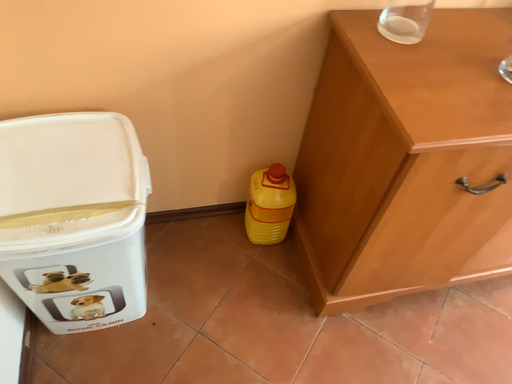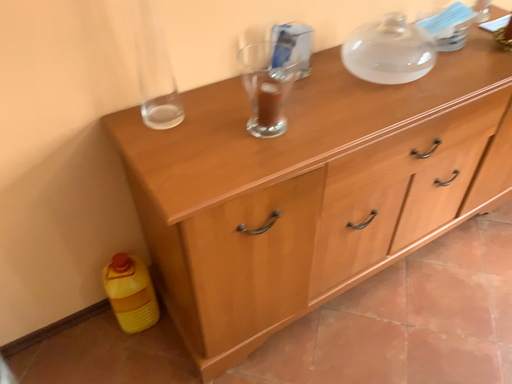
Question: How did the camera likely rotate when shooting the video?

Choices:
 (A) rotated right
 (B) rotated left

Answer: (A)